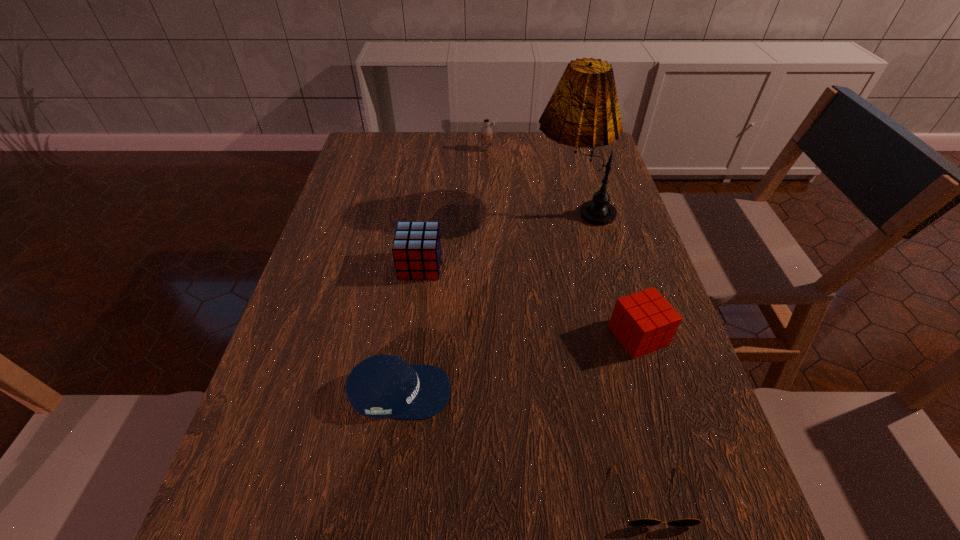
Where is `lampshade at the right edge`? The image size is (960, 540). lampshade at the right edge is located at coordinates (583, 111).

At what (x,y) coordinates should I click in order to perform the action: click on cube present at the right edge. Please return your answer as a coordinate pair (x, y). Looking at the image, I should click on (643, 322).

Identify the location of sunglasses located in the right edge section of the desktop. (644, 522).

Where is `vacant region at the far edge of the desktop`? The image size is (960, 540). vacant region at the far edge of the desktop is located at coordinates (443, 140).

Where is `free space at the left edge of the desktop`? free space at the left edge of the desktop is located at coordinates (268, 384).

Identify the location of vacant space at the far left corner. (384, 133).

Identify the location of free space between the nearer cube and the baseball cap. The image size is (960, 540). (518, 364).

Locate an element on the screen. This screenshot has width=960, height=540. vacant space in between the nearest object and the left cube is located at coordinates (x=537, y=381).

At what (x,y) coordinates should I click in order to perform the action: click on vacant space in between the third farthest object and the tallest object. Please return your answer as a coordinate pair (x, y). The image size is (960, 540). Looking at the image, I should click on (496, 238).

I want to click on empty space between the fifth nearest object and the fourth object from right to left, so click(529, 179).